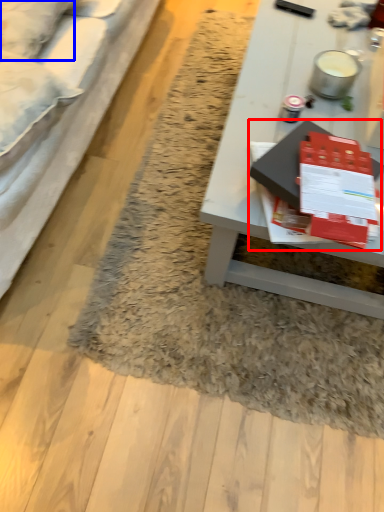
Question: Which of the following is the farthest to the observer, magazine (highlighted by a red box) or pillow (highlighted by a blue box)?

Choices:
 (A) magazine
 (B) pillow

Answer: (B)